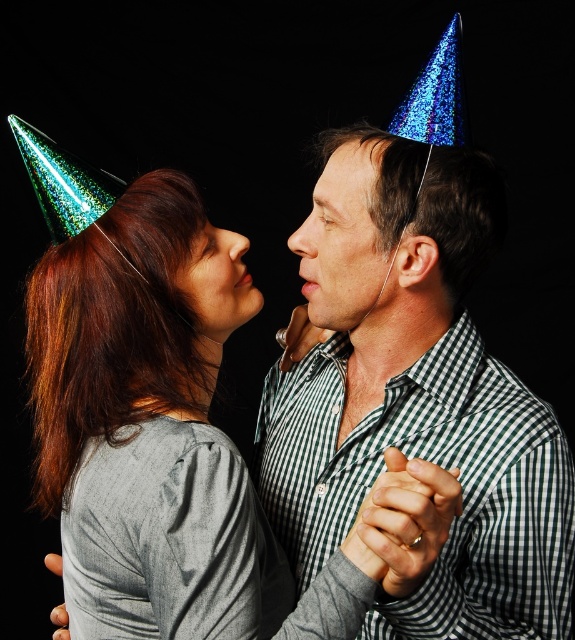
You are standing in front of the image and want to touch the point at coordinates point [366,326]. Can you reach it without moving your hand more than 1 meter away from your body?

The point [366,326] is 1.03 meters from viewer, so you cannot reach it without moving your hand more than 1 meter away from your body.

You are planning to place a new accessory on the matte skin at center in the image. Considering the size of the matte green party hat at center, can you determine if the accessory will fit without overlapping the hat?

The matte green party hat at center is wider than the matte skin at center, so placing an accessory might overlap since the hat is already occupying more space.

You are planning to stack the shiny blue party hat at center and the matte green party hat at center on top of each other. Which one should you place at the bottom to ensure stability?

The shiny blue party hat at center is much taller than the matte green party hat at center, so placing the taller one at the bottom would provide a more stable base for the stack.